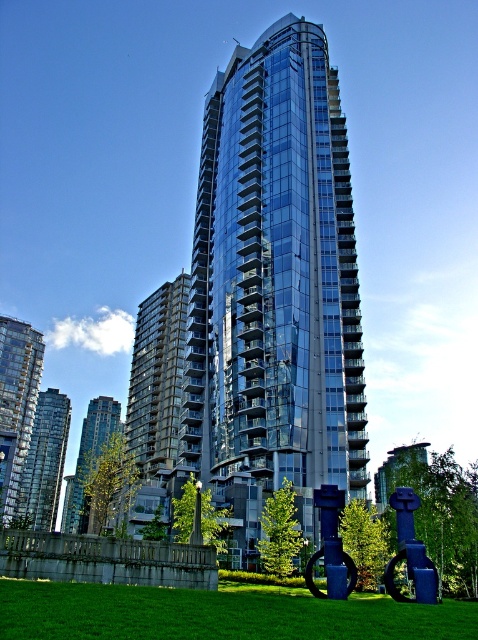
Between transparent glass building at center and matte glass building at left, which one has less height?

With less height is matte glass building at left.

Can you confirm if transparent glass building at center is wider than matte glass building at left?

Yes, transparent glass building at center is wider than matte glass building at left.

Identify the location of transparent glass building at center. (273, 288).

Based on the photo, between matte glass building at left and glassy reflective building at center, which one has more height?

With more height is glassy reflective building at center.

Does matte glass building at left have a lesser height compared to glassy reflective building at center?

Indeed, matte glass building at left has a lesser height compared to glassy reflective building at center.

You are a GUI agent. You are given a task and a screenshot of the screen. Output one action in this format:
    pyautogui.click(x=<x>, y=<y>)
    Task: Click on the matte glass building at left
    The image size is (478, 640).
    Given the screenshot: What is the action you would take?
    pyautogui.click(x=17, y=404)

Between green grass at lower center and glassy reflective building at center, which one appears on the right side from the viewer's perspective?

green grass at lower center is more to the right.

Is point (221, 589) closer to viewer compared to point (98, 440)?

That is True.

Where is `green grass at lower center`? green grass at lower center is located at coordinates (217, 614).